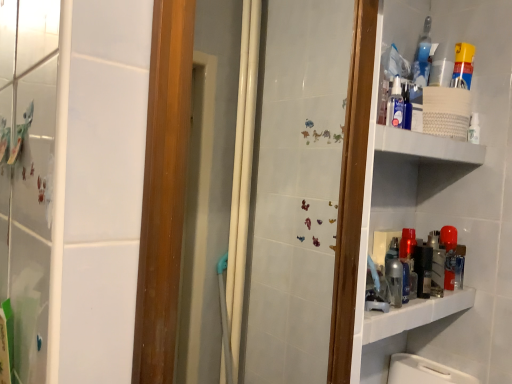
Question: Considering the relative positions of blue glass bottle at upper right and white textured shelf at upper right in the image provided, is blue glass bottle at upper right to the left of white textured shelf at upper right from the viewer's perspective?

Choices:
 (A) yes
 (B) no

Answer: (B)

Question: Is blue glass bottle at upper right to the right of white textured shelf at upper right from the viewer's perspective?

Choices:
 (A) yes
 (B) no

Answer: (A)

Question: Is blue glass bottle at upper right oriented away from white textured shelf at upper right?

Choices:
 (A) yes
 (B) no

Answer: (B)

Question: Is blue glass bottle at upper right completely or partially outside of white textured shelf at upper right?

Choices:
 (A) no
 (B) yes

Answer: (B)

Question: From a real-world perspective, is blue glass bottle at upper right beneath white textured shelf at upper right?

Choices:
 (A) no
 (B) yes

Answer: (A)

Question: Considering the relative positions of yellow plastic spray can at upper right and blue glass bottle at upper right in the image provided, is yellow plastic spray can at upper right to the left or to the right of blue glass bottle at upper right?

Choices:
 (A) right
 (B) left

Answer: (A)

Question: Considering the positions of yellow plastic spray can at upper right and blue glass bottle at upper right in the image, is yellow plastic spray can at upper right wider or thinner than blue glass bottle at upper right?

Choices:
 (A) thin
 (B) wide

Answer: (B)

Question: From a real-world perspective, is yellow plastic spray can at upper right positioned above or below blue glass bottle at upper right?

Choices:
 (A) above
 (B) below

Answer: (B)

Question: From the image's perspective, relative to blue glass bottle at upper right, is yellow plastic spray can at upper right above or below?

Choices:
 (A) below
 (B) above

Answer: (A)

Question: Choose the correct answer: Is blue glass bottle at upper right inside white textured shelf at upper right or outside it?

Choices:
 (A) outside
 (B) inside

Answer: (A)

Question: From a real-world perspective, relative to white textured shelf at upper right, is blue glass bottle at upper right vertically above or below?

Choices:
 (A) below
 (B) above

Answer: (B)

Question: Relative to white textured shelf at upper right, is blue glass bottle at upper right in front or behind?

Choices:
 (A) behind
 (B) front

Answer: (A)

Question: Is blue glass bottle at upper right wider or thinner than white textured shelf at upper right?

Choices:
 (A) wide
 (B) thin

Answer: (B)

Question: Considering the positions of white textured shelf at upper right and blue glass bottle at upper right in the image, is white textured shelf at upper right wider or thinner than blue glass bottle at upper right?

Choices:
 (A) wide
 (B) thin

Answer: (A)

Question: Is point (415, 150) positioned closer to the camera than point (417, 74)?

Choices:
 (A) farther
 (B) closer

Answer: (B)